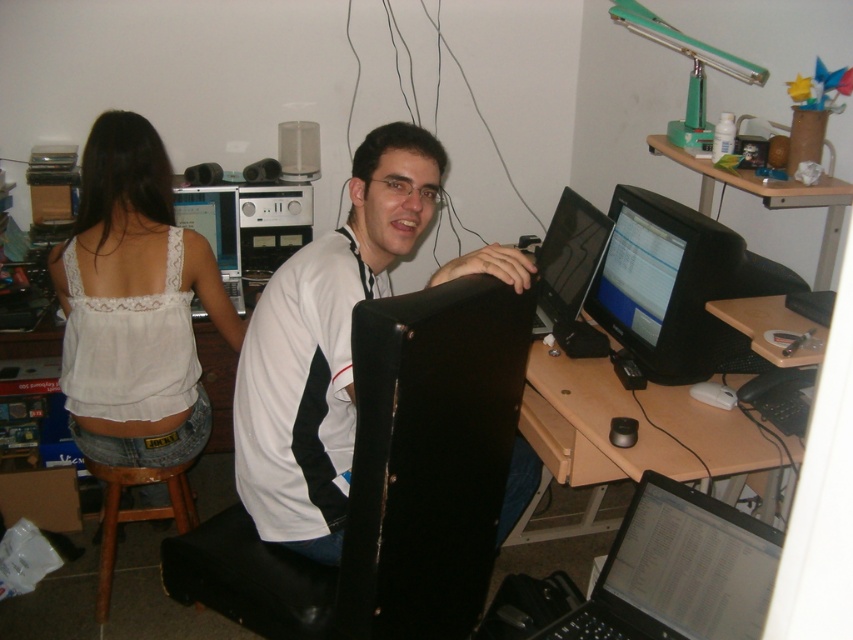
You are organizing a small party and need to place a 1.2 meter long banner between the wooden at center and the brown wooden stool at lower left. Based on their widths, will the banner fit horizontally between them?

The wooden at center is wider than the brown wooden stool at lower left. Since the banner is 1.2 meters long, it depends on the actual distance between them, but the question only mentions their widths. Without knowing the distance between the objects, we cannot determine if the banner will fit. However, the banner length is 1.2 meters, so if the space between them is at least that wide, it would fit. The given information only states the relative widths of the objects, not the space between them.